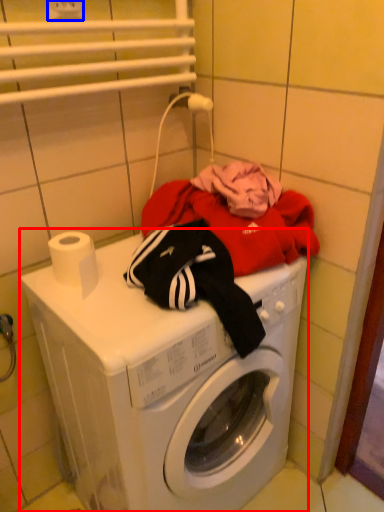
Question: Among these objects, which one is farthest to the camera, washing machine (highlighted by a red box) or electric outlet (highlighted by a blue box)?

Choices:
 (A) washing machine
 (B) electric outlet

Answer: (B)